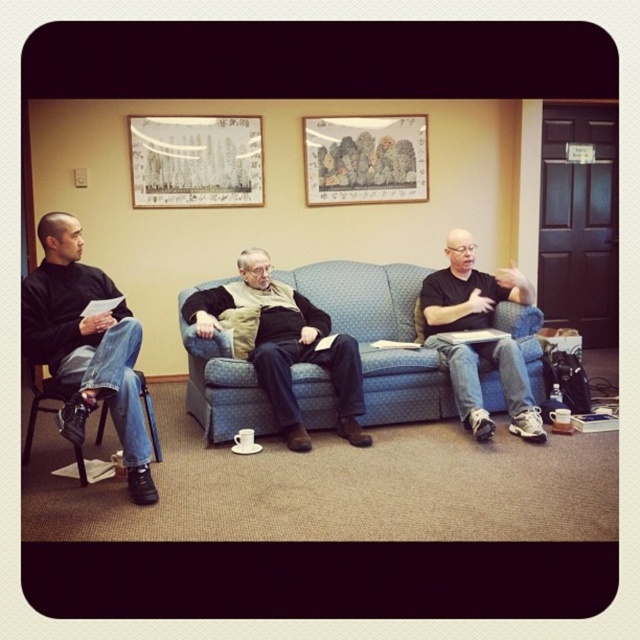
Is point (209, 356) closer to viewer compared to point (60, 394)?

No, it is not.

Who is more forward, [253,397] or [154,429]?

Positioned in front is point [154,429].

Identify the location of blue fabric couch at center. This screenshot has width=640, height=640. (380, 336).

Who is higher up, black matte jeans at left or black plastic chair at left?

black matte jeans at left is above.

Is point (38, 221) farther from viewer compared to point (52, 392)?

Yes, point (38, 221) is farther from viewer.

The height and width of the screenshot is (640, 640). Identify the location of black matte jeans at left. (86, 346).

Is point (401, 324) behind point (372, 168)?

No, (401, 324) is in front of (372, 168).

Who is shorter, blue fabric couch at center or wooden framed picture at center?

With less height is wooden framed picture at center.

Is point (404, 308) less distant than point (392, 157)?

That is True.

Locate an element on the screen. The height and width of the screenshot is (640, 640). blue fabric couch at center is located at coordinates (380, 336).